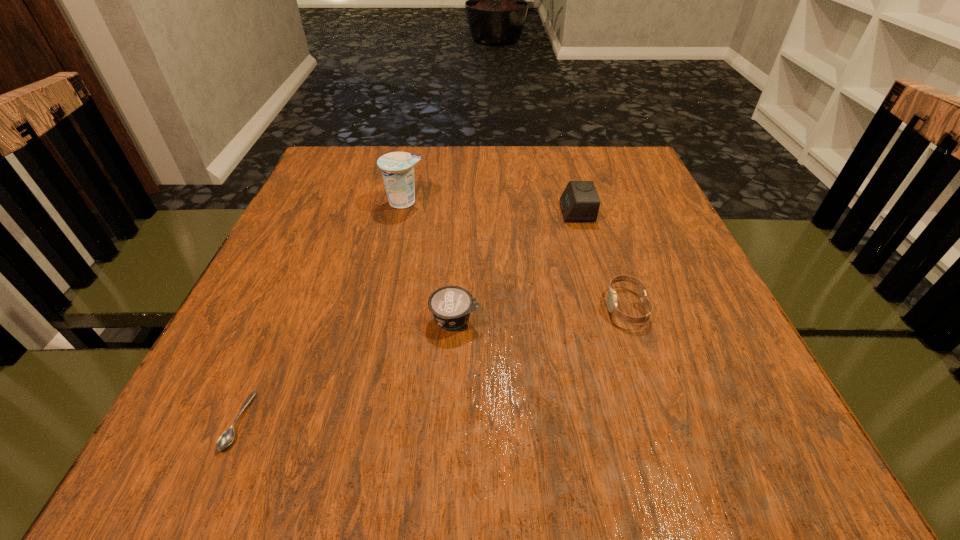
Image resolution: width=960 pixels, height=540 pixels. In order to click on free space that satisfies the following two spatial constraints: 1. on the face of the watch; 2. on the front side of the right yogurt in this screenshot , I will do `click(631, 319)`.